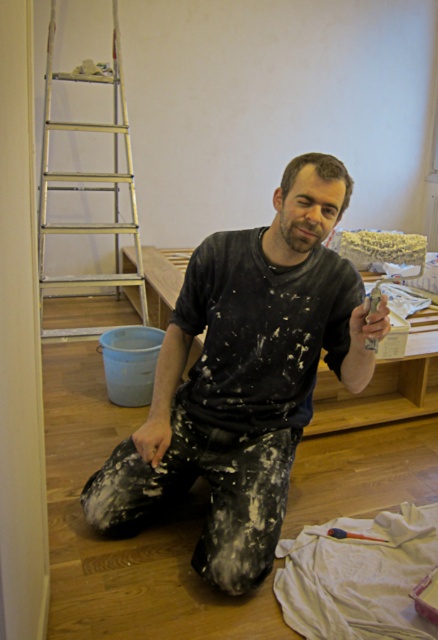
Which is more to the right, black matte shirt at center or silver metallic ladder at left?

From the viewer's perspective, black matte shirt at center appears more on the right side.

Between point (240, 339) and point (102, 124), which one is positioned in front?

Positioned in front is point (240, 339).

Does point (209, 520) come farther from viewer compared to point (136, 243)?

No, (209, 520) is in front of (136, 243).

Image resolution: width=438 pixels, height=640 pixels. What are the coordinates of `black matte shirt at center` in the screenshot? It's located at (244, 378).